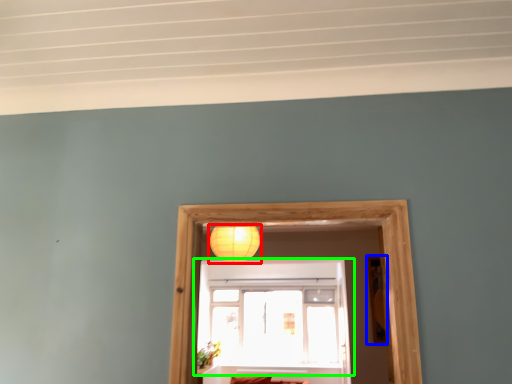
Question: Which is farther away from lamp (highlighted by a red box)? picture frame (highlighted by a blue box) or window (highlighted by a green box)?

Choices:
 (A) picture frame
 (B) window

Answer: (A)